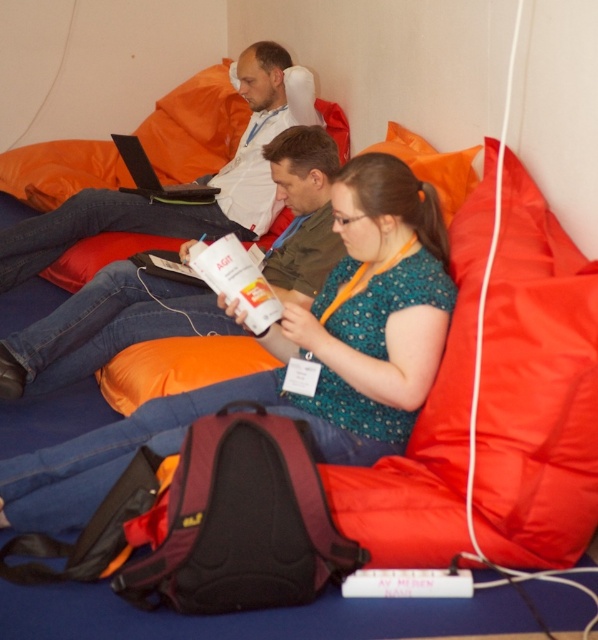
Question: Estimate the real-world distances between objects in this image. Which object is closer to the matte green dress at center?

Choices:
 (A) matte white laptop at upper center
 (B) matte white laptop at upper left

Answer: (B)

Question: Does matte white laptop at upper left have a lesser width compared to matte white laptop at upper center?

Choices:
 (A) yes
 (B) no

Answer: (A)

Question: Is matte white laptop at upper left to the left of matte white laptop at upper center from the viewer's perspective?

Choices:
 (A) no
 (B) yes

Answer: (B)

Question: Which point is farther to the camera?

Choices:
 (A) (251, 216)
 (B) (393, 392)
 (C) (334, 262)

Answer: (A)

Question: Is matte green dress at center positioned at the back of matte white laptop at upper left?

Choices:
 (A) yes
 (B) no

Answer: (B)

Question: Which point is farther to the camera?

Choices:
 (A) matte white laptop at upper left
 (B) matte white laptop at upper center
 (C) matte green dress at center

Answer: (B)